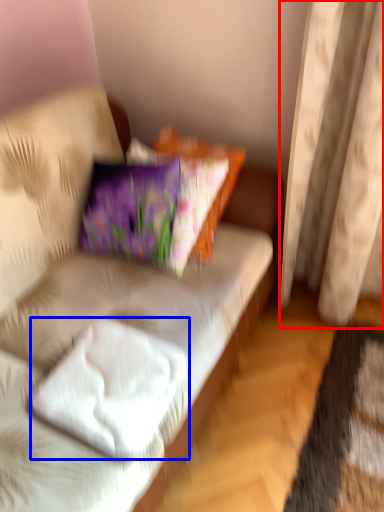
Question: Among these objects, which one is nearest to the camera, curtain (highlighted by a red box) or pillow (highlighted by a blue box)?

Choices:
 (A) curtain
 (B) pillow

Answer: (B)